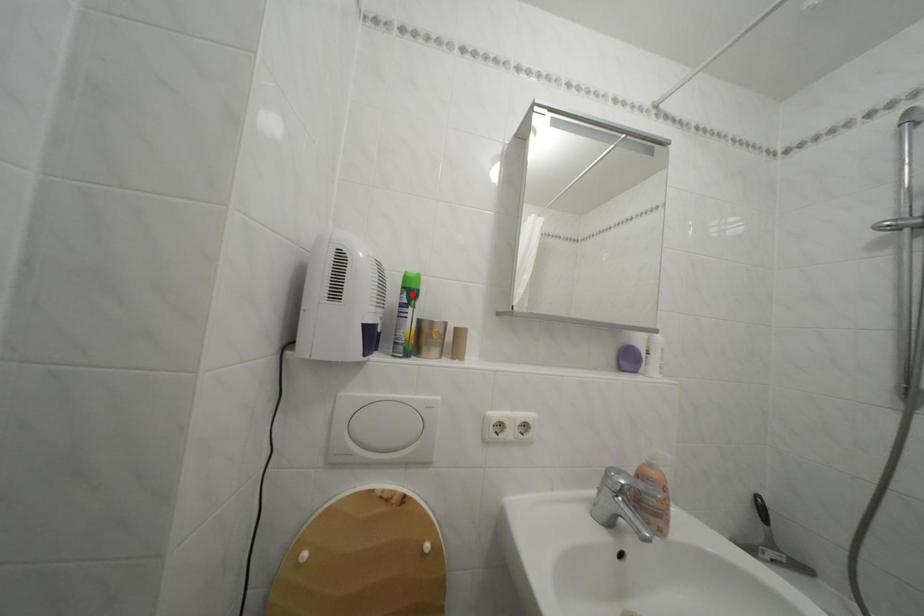
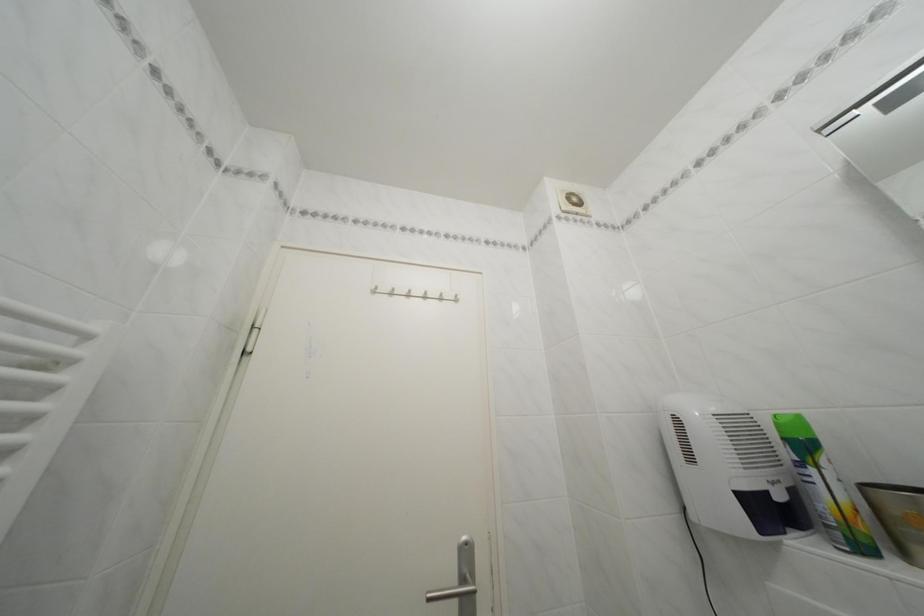
Where in the second image is the point corresponding to the highlighted location from the first image?

(793, 445)